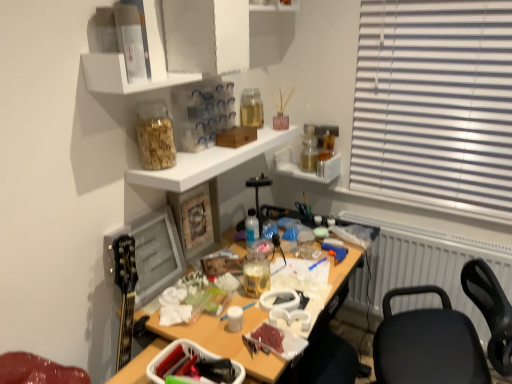
Question: Is translucent glass bottle at upper center, which is counted as the second bottle, starting from the left, smaller than white plastic radiator at right?

Choices:
 (A) no
 (B) yes

Answer: (B)

Question: Does translucent glass bottle at upper center, the 2th bottle from the back, have a lesser height compared to white plastic radiator at right?

Choices:
 (A) yes
 (B) no

Answer: (A)

Question: From the image's perspective, would you say translucent glass bottle at upper center, which is the 4th bottle from bottom to top, is positioned over white plastic radiator at right?

Choices:
 (A) yes
 (B) no

Answer: (A)

Question: From a real-world perspective, is translucent glass bottle at upper center, the 2th bottle from the back, on white plastic radiator at right?

Choices:
 (A) no
 (B) yes

Answer: (B)

Question: Considering the relative positions of translucent glass bottle at upper center, which is the 3th bottle in right-to-left order, and white plastic radiator at right in the image provided, is translucent glass bottle at upper center, which is the 3th bottle in right-to-left order, to the left of white plastic radiator at right from the viewer's perspective?

Choices:
 (A) yes
 (B) no

Answer: (A)

Question: Is translucent glass bottle at upper center, which ranks as the 1th bottle in top-to-bottom order, thinner than white plastic radiator at right?

Choices:
 (A) no
 (B) yes

Answer: (B)

Question: Is translucent glass jar at upper right, positioned as the 1th bottle in back-to-front order, to the left of white glossy shelf at upper center, positioned as the third shelf in bottom-to-top order, from the viewer's perspective?

Choices:
 (A) yes
 (B) no

Answer: (B)

Question: Does translucent glass jar at upper right, which is the 1th bottle in right-to-left order, have a greater width compared to white glossy shelf at upper center, acting as the 2th shelf starting from the top?

Choices:
 (A) no
 (B) yes

Answer: (A)

Question: Can you confirm if translucent glass jar at upper right, which is the 1th bottle in right-to-left order, is shorter than white glossy shelf at upper center, positioned as the third shelf in bottom-to-top order?

Choices:
 (A) yes
 (B) no

Answer: (B)

Question: Does translucent glass jar at upper right, which is the 1th bottle in right-to-left order, turn towards white glossy shelf at upper center, acting as the 2th shelf starting from the top?

Choices:
 (A) no
 (B) yes

Answer: (A)

Question: From the image's perspective, is translucent glass jar at upper right, which is the 1th bottle in right-to-left order, beneath white glossy shelf at upper center, acting as the 2th shelf starting from the top?

Choices:
 (A) no
 (B) yes

Answer: (B)

Question: Is translucent glass jar at upper right, the 4th bottle from the left, oriented away from white glossy shelf at upper center, positioned as the third shelf in bottom-to-top order?

Choices:
 (A) no
 (B) yes

Answer: (A)

Question: Does white glossy shelf at upper center, the 3th shelf when ordered from top to bottom, appear on the right side of clear plastic container at upper center, arranged as the first shelf when viewed from the top?

Choices:
 (A) no
 (B) yes

Answer: (A)